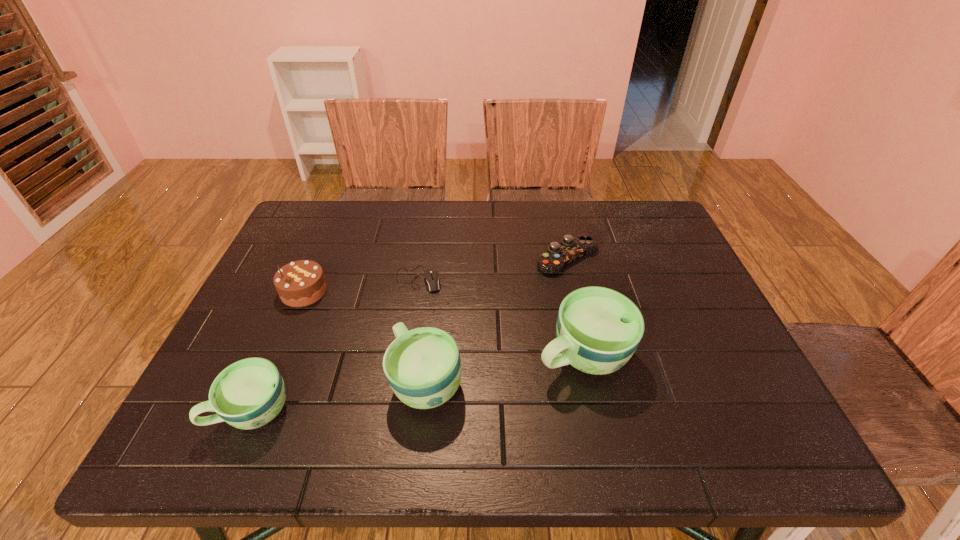
Locate an element on the screen. Image resolution: width=960 pixels, height=540 pixels. vacant space located 0.200m on the right of the chocolate cake is located at coordinates pos(405,292).

Where is `free location located 0.240m on the left of the computer mouse`? This screenshot has width=960, height=540. free location located 0.240m on the left of the computer mouse is located at coordinates (304, 279).

Locate an element on the screen. vacant space located on the back of the control is located at coordinates (556, 206).

The image size is (960, 540). Identify the location of object that is at the far edge. (571, 248).

The width and height of the screenshot is (960, 540). In order to click on cup that is at the left edge in this screenshot , I will do `click(248, 394)`.

The width and height of the screenshot is (960, 540). I want to click on chocolate cake that is positioned at the left edge, so click(300, 283).

You are a GUI agent. You are given a task and a screenshot of the screen. Output one action in this format:
    pyautogui.click(x=<x>, y=<y>)
    Task: Click on the object at the near left corner
    This screenshot has height=540, width=960.
    Given the screenshot: What is the action you would take?
    pyautogui.click(x=248, y=394)

Image resolution: width=960 pixels, height=540 pixels. In the image, there is a desktop. What are the coordinates of `vacant space at the far edge` in the screenshot? It's located at (609, 234).

Identify the location of vacant space at the left edge of the desktop. (321, 258).

This screenshot has width=960, height=540. In the image, there is a desktop. Identify the location of free space at the right edge. (677, 278).